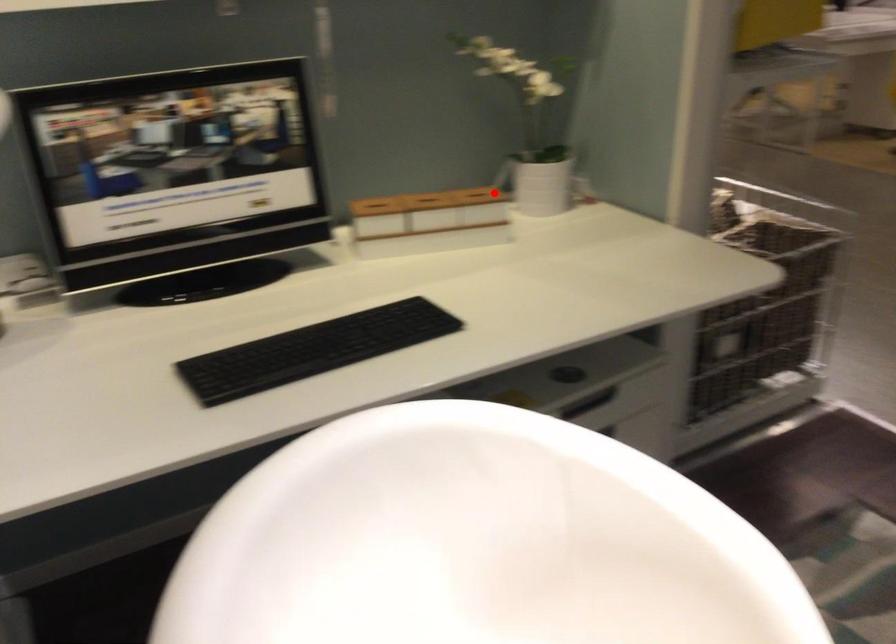
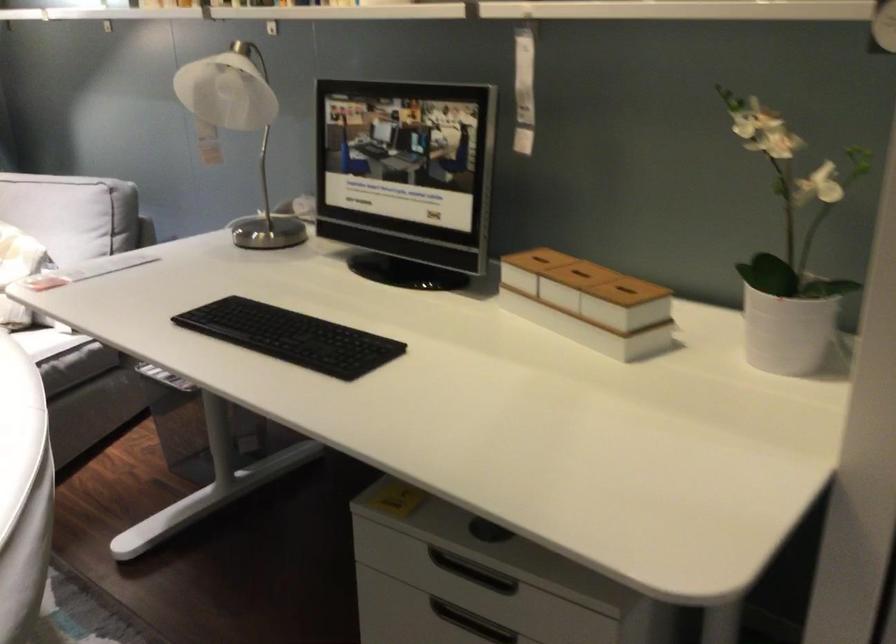
Locate, in the second image, the point that corresponds to the highlighted location in the first image.

(627, 290)